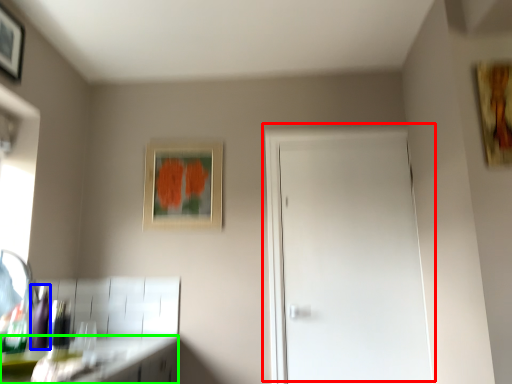
Question: Estimate the real-world distances between objects in this image. Which object is closer to door (highlighted by a red box), bottle (highlighted by a blue box) or counter top (highlighted by a green box)?

Choices:
 (A) bottle
 (B) counter top

Answer: (B)